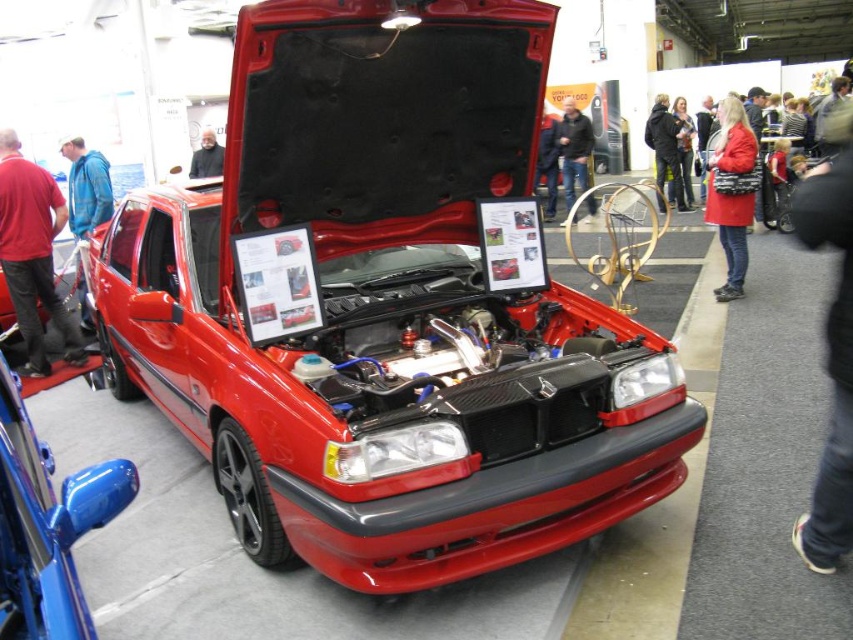
Between blonde hair at center and smooth black jacket at center, which one has more height?

blonde hair at center

Is point (683, 141) positioned after point (212, 156)?

Yes, it is behind point (212, 156).

Find the location of a particular element. blonde hair at center is located at coordinates (682, 152).

Between matte red coat at right and dark blue leather jacket at center, which one appears on the right side from the viewer's perspective?

matte red coat at right

Does point (743, 259) come closer to viewer compared to point (592, 209)?

Yes, point (743, 259) is closer to viewer.

Describe the element at coordinates (730, 193) in the screenshot. This screenshot has width=853, height=640. I see `matte red coat at right` at that location.

Locate an element on the screen. matte red coat at right is located at coordinates (730, 193).

Between point (518, 387) and point (82, 230), which one is positioned in front?

Positioned in front is point (518, 387).

What do you see at coordinates (387, 308) in the screenshot? Image resolution: width=853 pixels, height=640 pixels. I see `shiny red car at center` at bounding box center [387, 308].

The image size is (853, 640). What are the coordinates of `shiny red car at center` in the screenshot? It's located at [x=387, y=308].